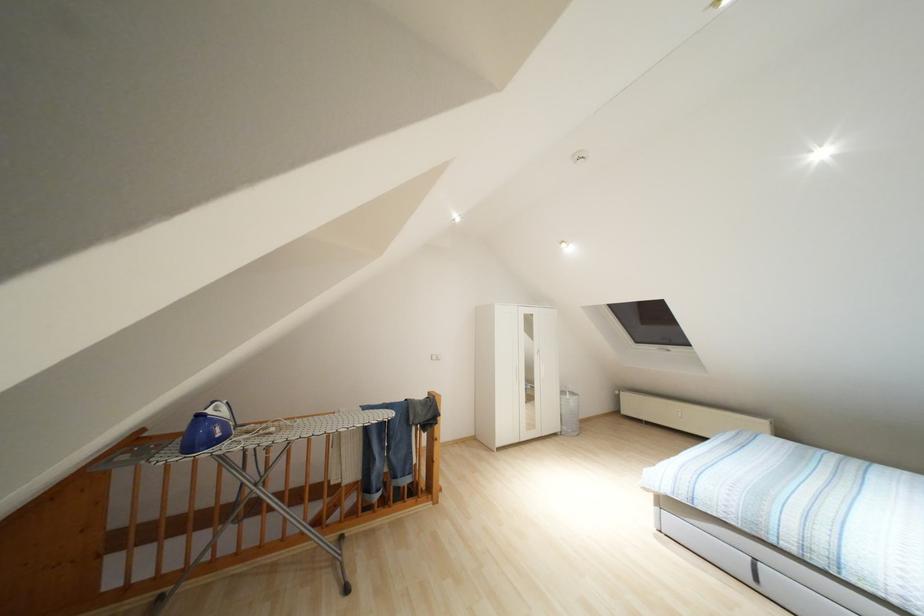
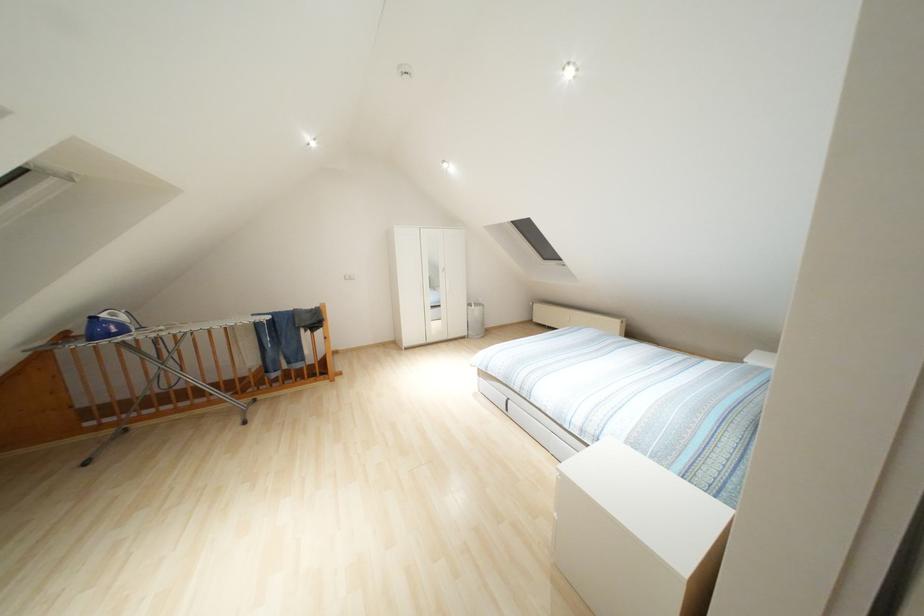
Find the pixel in the second image that matches point 200,415 in the first image.

(92, 318)